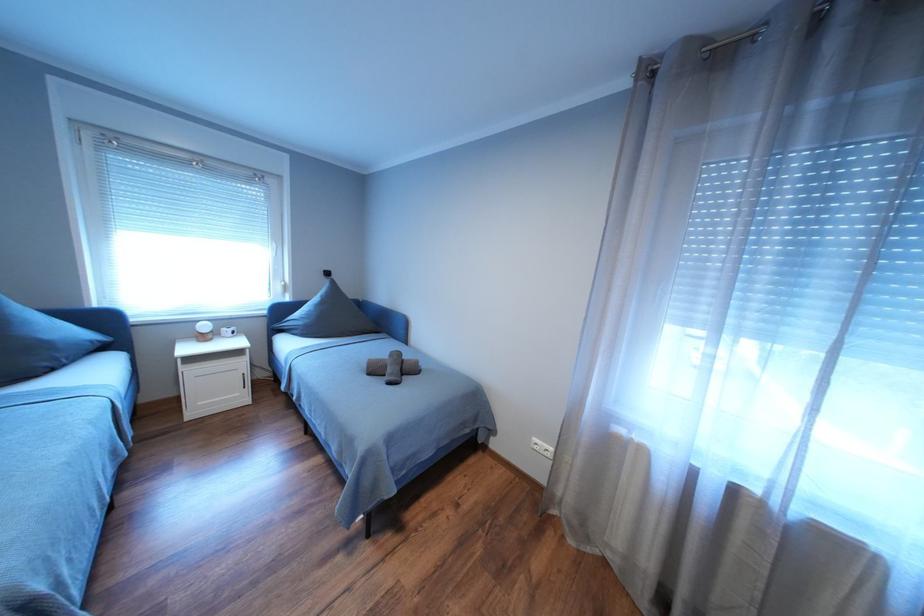
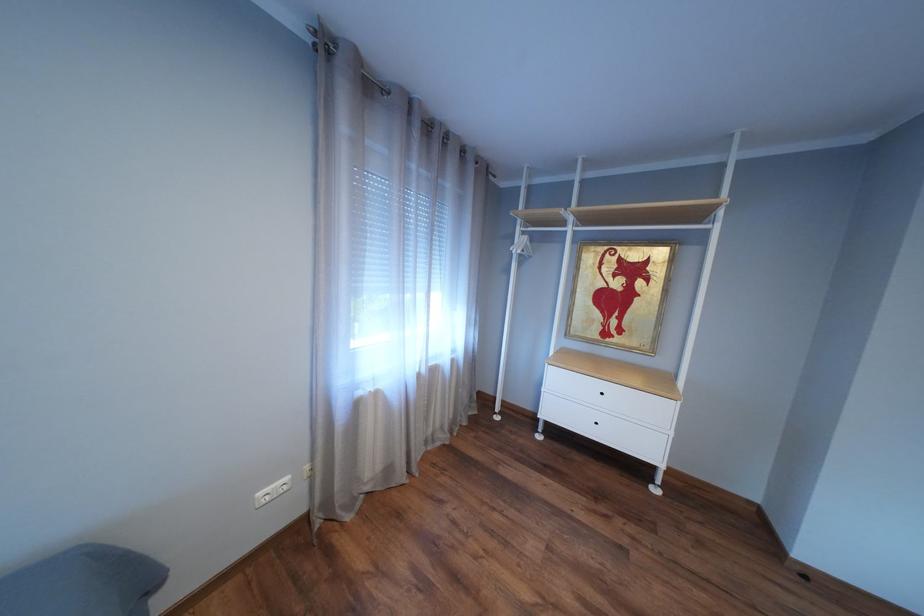
Based on the photo, the images are taken continuously from a first-person perspective. In which direction is your viewpoint rotating?

The rotation direction of the camera is right-down.